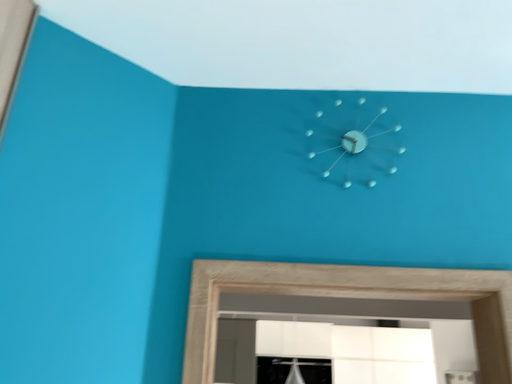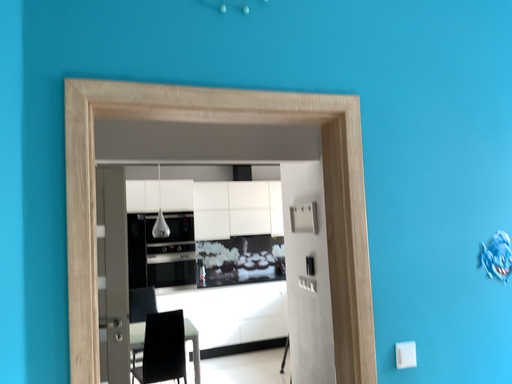
Question: How did the camera likely rotate when shooting the video?

Choices:
 (A) rotated right
 (B) rotated left

Answer: (A)